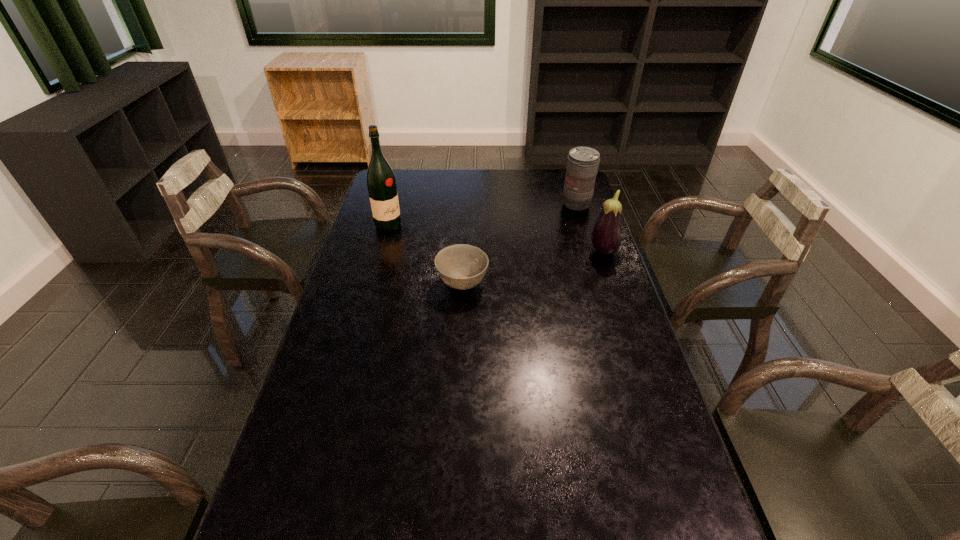
I want to click on vacant space on the desktop that is between the nearest object and the second nearest object and is positioned on the side of the telephoto lens where the control switches are located, so click(x=530, y=268).

Locate an element on the screen. vacant space on the desktop that is between the nearest object and the eggplant and is positioned on the front-facing side of the tallest object is located at coordinates (529, 269).